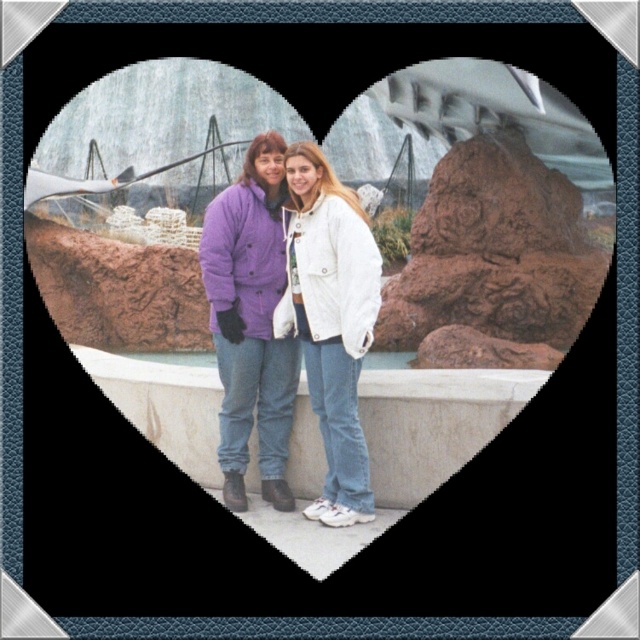
Question: Does purple cotton jacket at center appear under white concrete ledge at center?

Choices:
 (A) yes
 (B) no

Answer: (B)

Question: Which point appears closest to the camera in this image?

Choices:
 (A) (282, 164)
 (B) (310, 484)

Answer: (B)

Question: Which point is farther from the camera taking this photo?

Choices:
 (A) (428, 451)
 (B) (256, 369)

Answer: (B)

Question: Is purple cotton jacket at center closer to camera compared to white concrete ledge at center?

Choices:
 (A) no
 (B) yes

Answer: (A)

Question: Can you confirm if purple cotton jacket at center is positioned to the right of white concrete ledge at center?

Choices:
 (A) yes
 (B) no

Answer: (B)